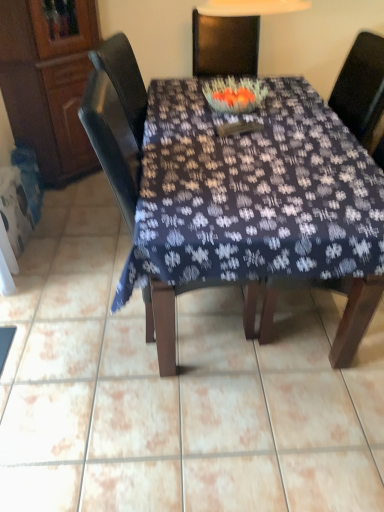
This screenshot has height=512, width=384. Identify the location of free space that is to the left of dark fabric table at center. (70, 275).